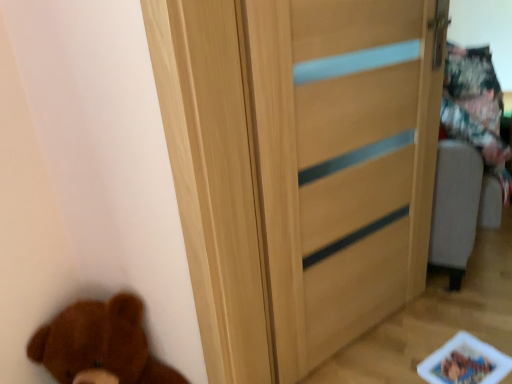
Question: From a real-world perspective, is brown plush bear at lower left over light wood door at center?

Choices:
 (A) yes
 (B) no

Answer: (B)

Question: Considering the relative sizes of brown plush bear at lower left and light wood door at center in the image provided, is brown plush bear at lower left bigger than light wood door at center?

Choices:
 (A) no
 (B) yes

Answer: (A)

Question: Does brown plush bear at lower left appear on the right side of light wood door at center?

Choices:
 (A) yes
 (B) no

Answer: (B)

Question: Is brown plush bear at lower left outside of light wood door at center?

Choices:
 (A) no
 (B) yes

Answer: (B)

Question: Is brown plush bear at lower left in front of light wood door at center?

Choices:
 (A) yes
 (B) no

Answer: (A)

Question: From the image's perspective, would you say brown plush bear at lower left is positioned over light wood door at center?

Choices:
 (A) yes
 (B) no

Answer: (B)

Question: Is light wood door at center positioned beyond the bounds of brown plush bear at lower left?

Choices:
 (A) yes
 (B) no

Answer: (A)

Question: From a real-world perspective, is light wood door at center beneath brown plush bear at lower left?

Choices:
 (A) no
 (B) yes

Answer: (A)

Question: From the image's perspective, is light wood door at center over brown plush bear at lower left?

Choices:
 (A) no
 (B) yes

Answer: (B)

Question: Is brown plush bear at lower left completely or partially inside light wood door at center?

Choices:
 (A) no
 (B) yes

Answer: (A)

Question: Considering the relative sizes of light wood door at center and brown plush bear at lower left in the image provided, is light wood door at center smaller than brown plush bear at lower left?

Choices:
 (A) no
 (B) yes

Answer: (A)

Question: Does light wood door at center have a lesser width compared to brown plush bear at lower left?

Choices:
 (A) yes
 (B) no

Answer: (A)

Question: Based on their positions, is light wood door at center located to the left or right of brown plush bear at lower left?

Choices:
 (A) right
 (B) left

Answer: (A)